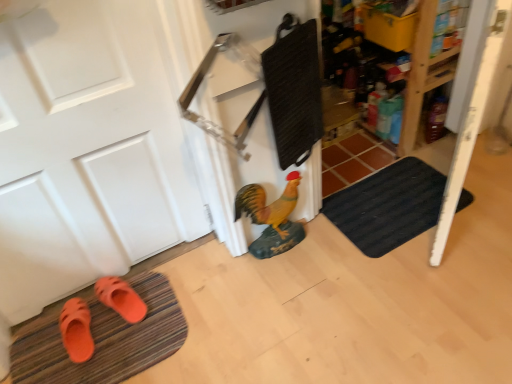
Where is `vacant space to the right of black textured bath mat at lower right, which appears as the 1th bath mat when viewed from the right`? vacant space to the right of black textured bath mat at lower right, which appears as the 1th bath mat when viewed from the right is located at coordinates (478, 195).